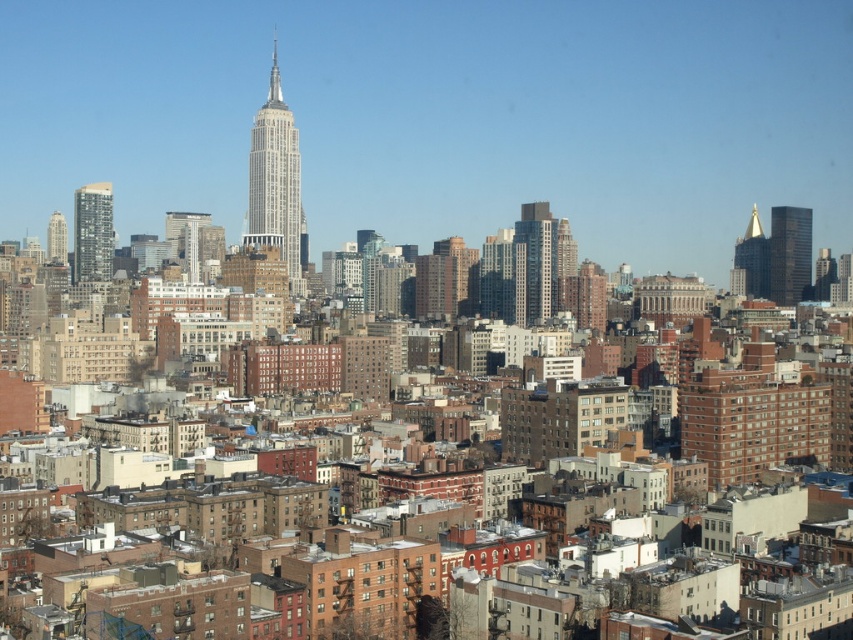
Based on the photo, which of these two, polished steel skyscraper at center or glassy silver skyscraper at center, stands taller?

polished steel skyscraper at center

Is polished steel skyscraper at center in front of glassy silver skyscraper at center?

No, polished steel skyscraper at center is further to the viewer.

Between point (276, 145) and point (531, 320), which one is positioned in front?

Positioned in front is point (531, 320).

Locate an element on the screen. This screenshot has width=853, height=640. polished steel skyscraper at center is located at coordinates 276,182.

Is glassy silver skyscraper at center further to the viewer compared to gold reflective spire at upper right?

No, glassy silver skyscraper at center is in front of gold reflective spire at upper right.

Which is more to the left, glassy silver skyscraper at center or gold reflective spire at upper right?

From the viewer's perspective, glassy silver skyscraper at center appears more on the left side.

Does point (531, 317) come closer to viewer compared to point (756, 211)?

Yes, point (531, 317) is closer to viewer.

Locate an element on the screen. The width and height of the screenshot is (853, 640). glassy silver skyscraper at center is located at coordinates (538, 257).

This screenshot has width=853, height=640. What do you see at coordinates (788, 253) in the screenshot?
I see `shiny glass skyscraper at right` at bounding box center [788, 253].

Can you confirm if shiny glass skyscraper at right is bigger than matte glass skyscraper at left?

Incorrect, shiny glass skyscraper at right is not larger than matte glass skyscraper at left.

Is point (804, 225) less distant than point (74, 198)?

That is False.

Locate an element on the screen. shiny glass skyscraper at right is located at coordinates (788, 253).